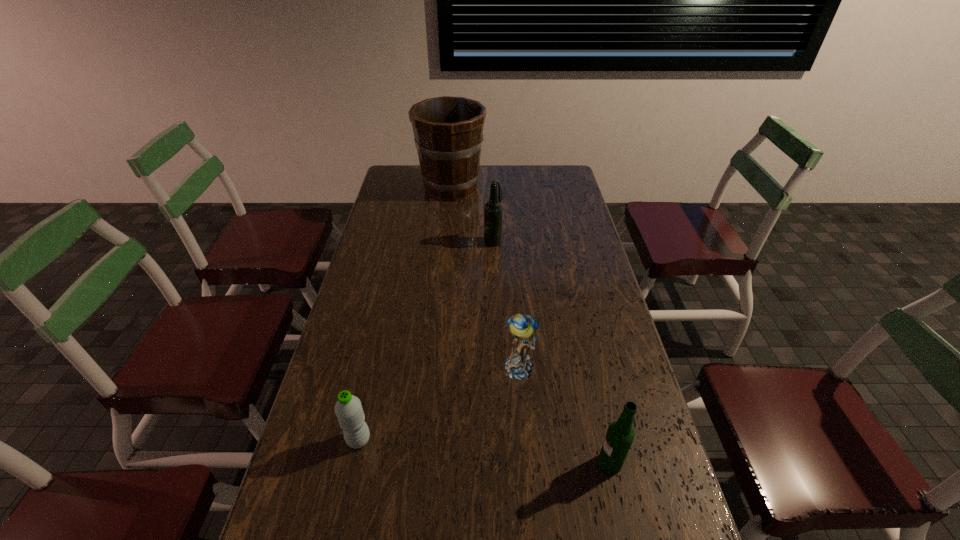
This screenshot has width=960, height=540. In order to click on the tallest object in this screenshot , I will do `click(448, 131)`.

You are a GUI agent. You are given a task and a screenshot of the screen. Output one action in this format:
    pyautogui.click(x=<x>, y=<y>)
    Task: Click on the farthest object
    
    Given the screenshot: What is the action you would take?
    pyautogui.click(x=448, y=131)

This screenshot has width=960, height=540. What are the coordinates of `the second farthest object` in the screenshot? It's located at (493, 209).

What are the coordinates of `the left beer bottle` in the screenshot? It's located at (493, 209).

Where is `parrot`? This screenshot has width=960, height=540. parrot is located at coordinates (522, 327).

The height and width of the screenshot is (540, 960). In order to click on the right beer bottle in this screenshot , I will do `click(620, 435)`.

Locate an element on the screen. the nearer beer bottle is located at coordinates (620, 435).

The height and width of the screenshot is (540, 960). Find the location of `the second nearest object`. the second nearest object is located at coordinates point(348,409).

The image size is (960, 540). Identify the location of the shortest object. (348, 409).

Image resolution: width=960 pixels, height=540 pixels. I want to click on vacant region located on the front of the farthest object, so pyautogui.click(x=445, y=253).